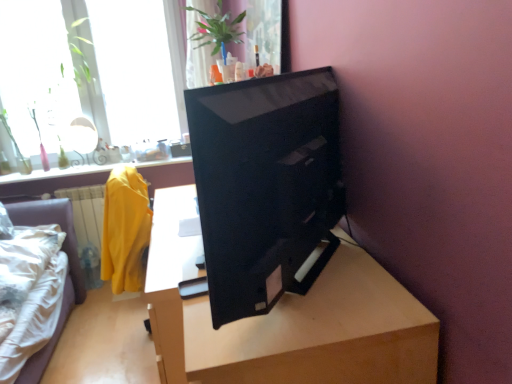
Question: Considering the relative sizes of transparent glass window at upper left, positioned as the 1th window in right-to-left order, and transparent glass window at upper left, which appears as the 1th window when viewed from the left, in the image provided, is transparent glass window at upper left, positioned as the 1th window in right-to-left order, shorter than transparent glass window at upper left, which appears as the 1th window when viewed from the left,?

Choices:
 (A) no
 (B) yes

Answer: (A)

Question: Can you confirm if transparent glass window at upper left, positioned as the 1th window in right-to-left order, is smaller than transparent glass window at upper left, which is the second window in right-to-left order?

Choices:
 (A) no
 (B) yes

Answer: (B)

Question: From the image's perspective, would you say transparent glass window at upper left, positioned as the 1th window in right-to-left order, is shown under transparent glass window at upper left, which appears as the 1th window when viewed from the left?

Choices:
 (A) no
 (B) yes

Answer: (A)

Question: From a real-world perspective, is transparent glass window at upper left, positioned as the 1th window in right-to-left order, on transparent glass window at upper left, which is the second window in right-to-left order?

Choices:
 (A) no
 (B) yes

Answer: (B)

Question: Is transparent glass window at upper left, positioned as the 1th window in right-to-left order, thinner than transparent glass window at upper left, which appears as the 1th window when viewed from the left?

Choices:
 (A) yes
 (B) no

Answer: (A)

Question: Is transparent glass window at upper left, which appears as the 1th window when viewed from the left, inside or outside of light brown wood table at center?

Choices:
 (A) inside
 (B) outside

Answer: (B)

Question: Based on their sizes in the image, would you say transparent glass window at upper left, which appears as the 1th window when viewed from the left, is bigger or smaller than light brown wood table at center?

Choices:
 (A) big
 (B) small

Answer: (B)

Question: From the image's perspective, is transparent glass window at upper left, which appears as the 1th window when viewed from the left, located above or below light brown wood table at center?

Choices:
 (A) above
 (B) below

Answer: (A)

Question: Is point (70, 82) positioned closer to the camera than point (159, 299)?

Choices:
 (A) farther
 (B) closer

Answer: (A)

Question: Based on their sizes in the image, would you say transparent glass window at upper left, which is counted as the second window, starting from the left, is bigger or smaller than light brown wood table at center?

Choices:
 (A) big
 (B) small

Answer: (B)

Question: From a real-world perspective, is transparent glass window at upper left, positioned as the 1th window in right-to-left order, above or below light brown wood table at center?

Choices:
 (A) above
 (B) below

Answer: (A)

Question: In terms of height, does transparent glass window at upper left, positioned as the 1th window in right-to-left order, look taller or shorter compared to light brown wood table at center?

Choices:
 (A) tall
 (B) short

Answer: (A)

Question: In terms of width, does transparent glass window at upper left, positioned as the 1th window in right-to-left order, look wider or thinner when compared to light brown wood table at center?

Choices:
 (A) thin
 (B) wide

Answer: (A)

Question: Is light brown wood table at center spatially inside transparent glass window at upper left, which is counted as the second window, starting from the left, or outside of it?

Choices:
 (A) outside
 (B) inside

Answer: (A)

Question: Is light brown wood table at center taller or shorter than transparent glass window at upper left, positioned as the 1th window in right-to-left order?

Choices:
 (A) tall
 (B) short

Answer: (B)